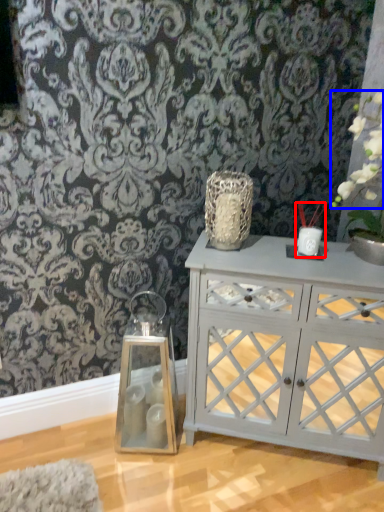
Question: Which of the following is the farthest to the observer, candle holder (highlighted by a red box) or floral arrangement (highlighted by a blue box)?

Choices:
 (A) candle holder
 (B) floral arrangement

Answer: (A)